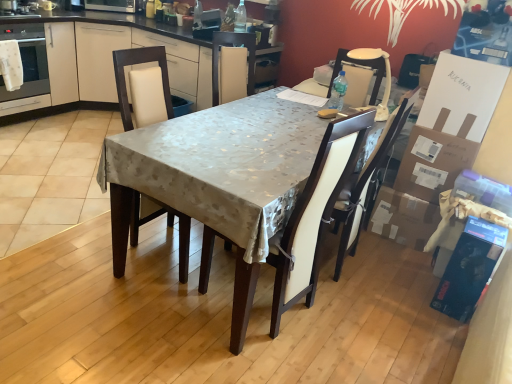
Identify the location of vacant space that is to the left of white leather chair at center, the 2th chair in the right-to-left sequence. (170, 312).